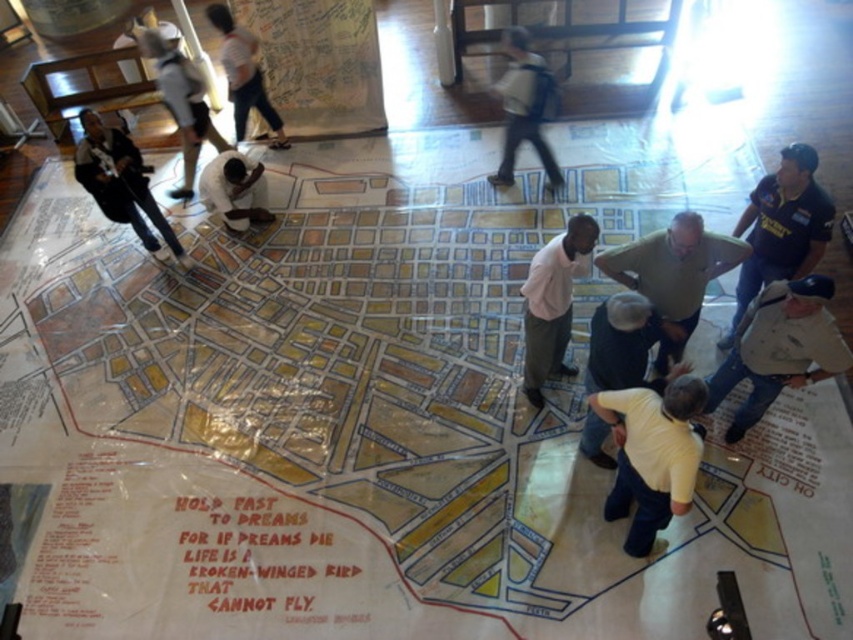
Question: Which point is farther from the camera taking this photo?

Choices:
 (A) (144, 166)
 (B) (788, 161)
 (C) (236, 218)
 (D) (665, 332)

Answer: (C)

Question: Which of the following is the closest to the observer?

Choices:
 (A) white paper at lower right
 (B) pink shirt at center
 (C) light yellow shirt at center
 (D) light blue jeans at center

Answer: (A)

Question: In this image, where is white paper at lower right located relative to pink shirt at center?

Choices:
 (A) left
 (B) right

Answer: (B)

Question: Can you confirm if yellow shirt at lower right is smaller than light brown shirt at center?

Choices:
 (A) yes
 (B) no

Answer: (A)

Question: Can you confirm if yellow shirt at lower right is smaller than light yellow shirt at center?

Choices:
 (A) yes
 (B) no

Answer: (A)

Question: Which of the following is the farthest from the observer?

Choices:
 (A) white shirt at upper left
 (B) dark blue jeans at lower left
 (C) light brown shirt at center
 (D) pink shirt at center

Answer: (A)